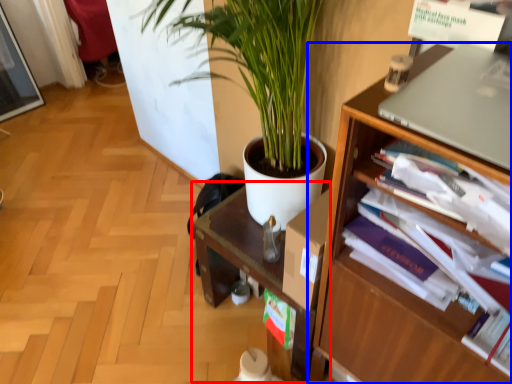
Question: Which of the following is the closest to the observer, computer desk (highlighted by a red box) or shelf (highlighted by a blue box)?

Choices:
 (A) computer desk
 (B) shelf

Answer: (B)